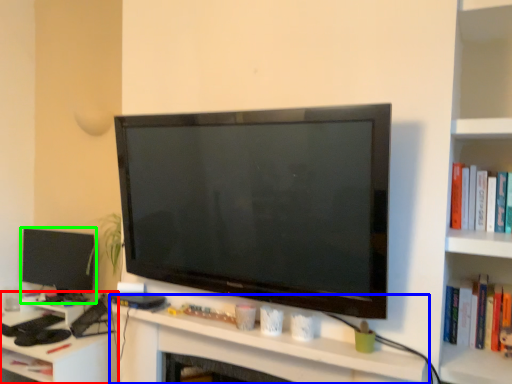
Question: Based on their relative distances, which object is nearer to computer desk (highlighted by a red box)? Choose from computer (highlighted by a blue box) and television (highlighted by a green box).

Choices:
 (A) computer
 (B) television

Answer: (B)